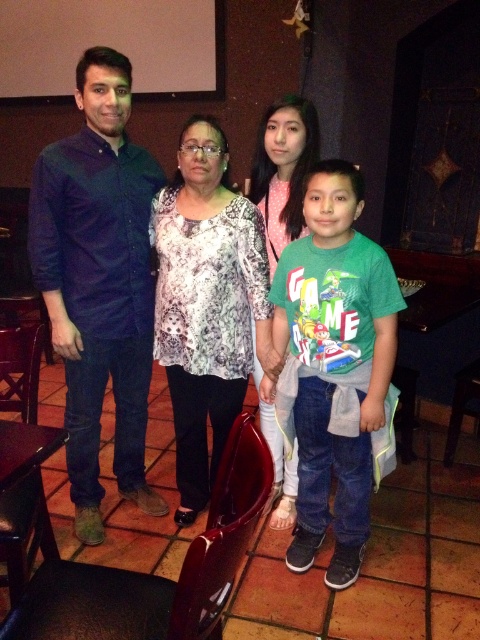
Question: Can you confirm if dark blue corduroy shirt at left is wider than pink dotted blouse at center?

Choices:
 (A) yes
 (B) no

Answer: (A)

Question: Which point appears farthest from the camera in this image?

Choices:
 (A) (271, 426)
 (B) (94, 289)
 (C) (365, 368)

Answer: (A)

Question: Which point appears closest to the camera in this image?

Choices:
 (A) (264, 348)
 (B) (264, 170)
 (C) (356, 264)
 (D) (98, 536)

Answer: (C)

Question: In this image, where is dark blue corduroy shirt at left located relative to pink dotted blouse at center?

Choices:
 (A) below
 (B) above

Answer: (A)

Question: Can you confirm if green cotton shirt at center is wider than pink dotted blouse at center?

Choices:
 (A) yes
 (B) no

Answer: (A)

Question: Among these objects, which one is farthest from the camera?

Choices:
 (A) pink dotted blouse at center
 (B) dark blue corduroy shirt at left
 (C) printed fabric blouse at center
 (D) green cotton shirt at center

Answer: (A)